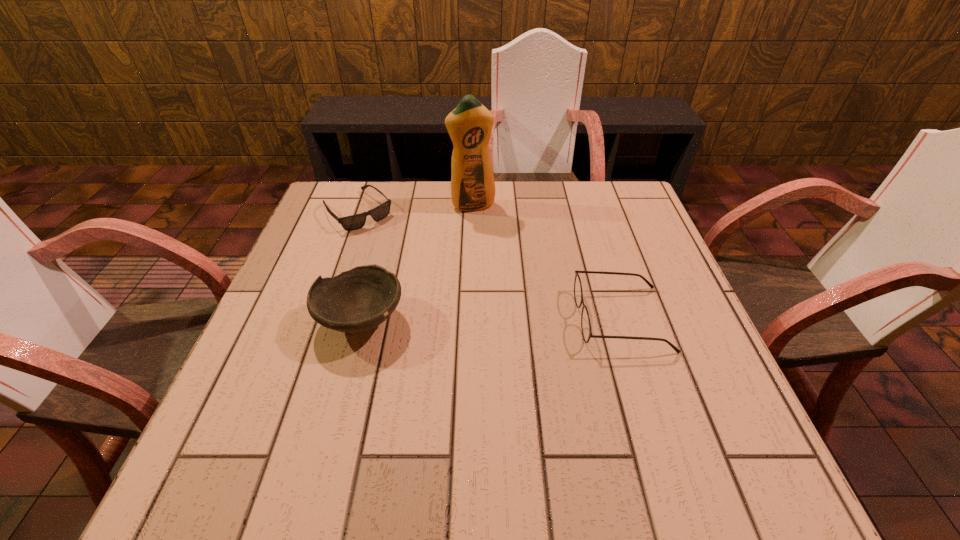
Where is `vacant space that's between the third shortest object and the tallest object`? vacant space that's between the third shortest object and the tallest object is located at coordinates (417, 263).

Where is `free spot between the bowl and the tallest object`? The height and width of the screenshot is (540, 960). free spot between the bowl and the tallest object is located at coordinates (417, 263).

This screenshot has width=960, height=540. Identify the location of vacant area between the second tallest object and the rightmost object. (492, 319).

At what (x,y) coordinates should I click in order to perform the action: click on vacant space in between the sunglasses and the detergent. Please return your answer as a coordinate pair (x, y). The width and height of the screenshot is (960, 540). Looking at the image, I should click on coord(415,208).

What are the coordinates of `empty location between the shortest object and the third shortest object` in the screenshot? It's located at (359, 265).

This screenshot has height=540, width=960. I want to click on vacant space in between the third tallest object and the third shortest object, so click(x=492, y=319).

Identify the location of vacant area between the shortest object and the tallest object. Image resolution: width=960 pixels, height=540 pixels. (415, 208).

At what (x,y) coordinates should I click in order to perform the action: click on free space between the bowl and the rightmost object. Please return your answer as a coordinate pair (x, y). This screenshot has width=960, height=540. Looking at the image, I should click on (492, 319).

Identify which object is located as the nearest to the third tallest object. Please provide its 2D coordinates. Your answer should be formatted as a tuple, i.e. [(x, y)], where the tuple contains the x and y coordinates of a point satisfying the conditions above.

[(469, 125)]

Select which object is the second closest to the shortest object. Please provide its 2D coordinates. Your answer should be formatted as a tuple, i.e. [(x, y)], where the tuple contains the x and y coordinates of a point satisfying the conditions above.

[(355, 301)]